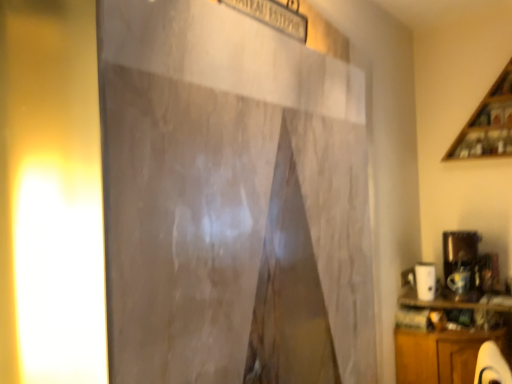
Question: In terms of height, does wooden cabinet at lower right look taller or shorter compared to wooden at upper right?

Choices:
 (A) short
 (B) tall

Answer: (A)

Question: Does point (471, 380) appear closer or farther from the camera than point (505, 99)?

Choices:
 (A) closer
 (B) farther

Answer: (A)

Question: Estimate the real-world distances between objects in this image. Which object is farther from the wooden cabinet at lower right?

Choices:
 (A) yellow matte light at left
 (B) wooden at upper right

Answer: (A)

Question: Estimate the real-world distances between objects in this image. Which object is closer to the wooden at upper right?

Choices:
 (A) yellow matte light at left
 (B) wooden cabinet at lower right

Answer: (B)